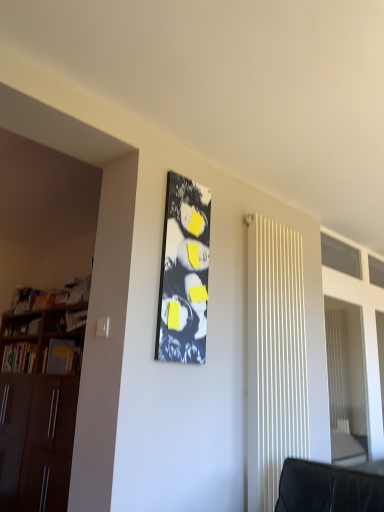
The width and height of the screenshot is (384, 512). What do you see at coordinates (19, 357) in the screenshot?
I see `hardcover book at left` at bounding box center [19, 357].

Identify the location of white ribbed radiator at right. (275, 358).

At what (x,y) coordinates should I click in order to perform the action: click on wooden at left. Please return your answer as a coordinate pair (x, y). Image resolution: width=384 pixels, height=512 pixels. Looking at the image, I should click on (67, 320).

This screenshot has height=512, width=384. Describe the element at coordinates (67, 320) in the screenshot. I see `wooden at left` at that location.

Identify the location of matte black bulletin board at center. (184, 273).

Locate an element on the screen. Image resolution: width=384 pixels, height=512 pixels. hardcover book at left is located at coordinates (19, 357).

Based on their sizes in the image, would you say wooden at left is bigger or smaller than matte black bulletin board at center?

Considering their sizes, wooden at left takes up more space than matte black bulletin board at center.

Between wooden at left and matte black bulletin board at center, which one has smaller width?

matte black bulletin board at center is thinner.

Between point (204, 320) and point (12, 344), which one is positioned in front?

Positioned in front is point (204, 320).

Is matte black bulletin board at center at the right side of hardcover book at left?

Yes.

Which of these two, matte black bulletin board at center or hardcover book at left, is smaller?

With smaller size is matte black bulletin board at center.

The width and height of the screenshot is (384, 512). Find the location of `bulletin board above the hardcover book at left (from a real-world perspective)`. bulletin board above the hardcover book at left (from a real-world perspective) is located at coordinates (184, 273).

Is white ribbed radiator at right at the right side of wooden at left?

Yes.

Does white ribbed radiator at right have a larger size compared to wooden at left?

Yes.

Where is `shelf to the left of white ribbed radiator at right`? The height and width of the screenshot is (512, 384). shelf to the left of white ribbed radiator at right is located at coordinates (67, 320).

Between white ribbed radiator at right and wooden at left, which one is positioned in front?

Positioned in front is white ribbed radiator at right.

Between hardcover book at left and matte black bulletin board at center, which one is positioned behind?

Positioned behind is hardcover book at left.

Considering the sizes of objects hardcover book at left and matte black bulletin board at center in the image provided, who is smaller, hardcover book at left or matte black bulletin board at center?

matte black bulletin board at center.

Which object is positioned more to the left, hardcover book at left or matte black bulletin board at center?

hardcover book at left.

From the image's perspective, relative to matte black bulletin board at center, is hardcover book at left above or below?

Based on their image positions, hardcover book at left is located beneath matte black bulletin board at center.

Considering the positions of objects matte black bulletin board at center and wooden at left in the image provided, who is more to the left, matte black bulletin board at center or wooden at left?

wooden at left.

Is matte black bulletin board at center wider or thinner than wooden at left?

matte black bulletin board at center is thinner than wooden at left.

Between point (177, 286) and point (48, 332), which one is positioned behind?

Positioned behind is point (48, 332).

This screenshot has height=512, width=384. In order to click on radiator that appears below the matte black bulletin board at center (from a real-world perspective) in this screenshot , I will do `click(275, 358)`.

Between point (251, 496) and point (186, 328), which one is positioned in front?

The point (186, 328) is more forward.

Does white ribbed radiator at right have a greater height compared to matte black bulletin board at center?

Yes.

From the image's perspective, is white ribbed radiator at right located above matte black bulletin board at center?

No, from the image's perspective, white ribbed radiator at right is not above matte black bulletin board at center.

Can you confirm if wooden at left is shorter than white ribbed radiator at right?

Indeed, wooden at left has a lesser height compared to white ribbed radiator at right.

From the image's perspective, does wooden at left appear lower than white ribbed radiator at right?

Yes, from the image's perspective, wooden at left is below white ribbed radiator at right.

In the scene shown: Is wooden at left far from white ribbed radiator at right?

wooden at left is far away from white ribbed radiator at right.

Find the location of a particular element. The image size is (384, 512). bulletin board that is above the wooden at left (from a real-world perspective) is located at coordinates (184, 273).

I want to click on book beneath the matte black bulletin board at center (from a real-world perspective), so click(x=19, y=357).

From the image, which object appears to be farther from matte black bulletin board at center, white ribbed radiator at right or wooden at left?

Based on the image, wooden at left appears to be further to matte black bulletin board at center.

Based on their spatial positions, is white ribbed radiator at right or matte black bulletin board at center further from wooden at left?

white ribbed radiator at right lies further to wooden at left than the other object.

Looking at the image, which one is located further to hardcover book at left, wooden at left or white ribbed radiator at right?

The object further to hardcover book at left is white ribbed radiator at right.

Estimate the real-world distances between objects in this image. Which object is further from wooden at left, hardcover book at left or matte black bulletin board at center?

matte black bulletin board at center is positioned further to the anchor wooden at left.

Considering their positions, is wooden at left positioned closer to matte black bulletin board at center than hardcover book at left?

wooden at left is positioned closer to the anchor matte black bulletin board at center.

Looking at this image, estimate the real-world distances between objects in this image. Which object is further from white ribbed radiator at right, matte black bulletin board at center or wooden at left?

The object further to white ribbed radiator at right is wooden at left.

Looking at the image, which one is located further to wooden at left, matte black bulletin board at center or white ribbed radiator at right?

white ribbed radiator at right is further to wooden at left.

Which object lies nearer to the anchor point hardcover book at left, matte black bulletin board at center or white ribbed radiator at right?

matte black bulletin board at center lies closer to hardcover book at left than the other object.

Where is `radiator between matte black bulletin board at center and hardcover book at left along the z-axis`? The image size is (384, 512). radiator between matte black bulletin board at center and hardcover book at left along the z-axis is located at coordinates (275, 358).

Where is `shelf between matte black bulletin board at center and hardcover book at left in the front-back direction`? Image resolution: width=384 pixels, height=512 pixels. shelf between matte black bulletin board at center and hardcover book at left in the front-back direction is located at coordinates pyautogui.click(x=67, y=320).

Identify the location of radiator between matte black bulletin board at center and wooden at left along the z-axis. This screenshot has width=384, height=512. (275, 358).

At what (x,y) coordinates should I click in order to perform the action: click on shelf between hardcover book at left and white ribbed radiator at right in the horizontal direction. Please return your answer as a coordinate pair (x, y). Looking at the image, I should click on [67, 320].